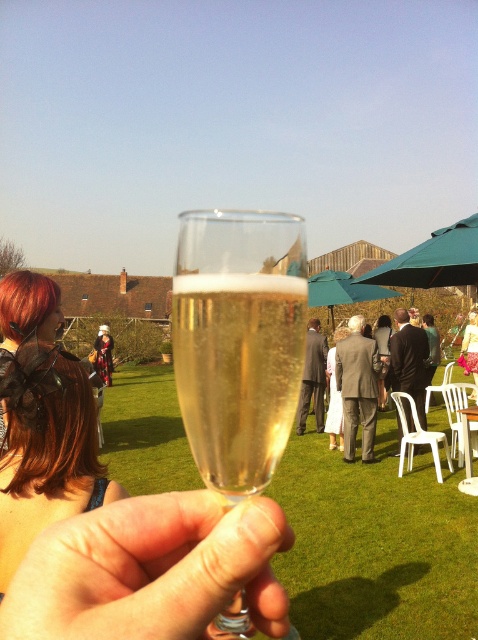
You are a photographer at the event and want to capture a closeup of the brown hair at lower left. Where should you focus your camera?

You should focus your camera at point (x=46, y=451) to capture the brown hair at lower left.

Looking at this image, you are at the gathering and want to move from the point at coordinates point (273,605) to the point at coordinates point (469,312). Which direction should you move to get there?

To move from point (273,605) to point (469,312), you should move towards the upper left direction since point (469,312) is located above and to the left of point (273,605).